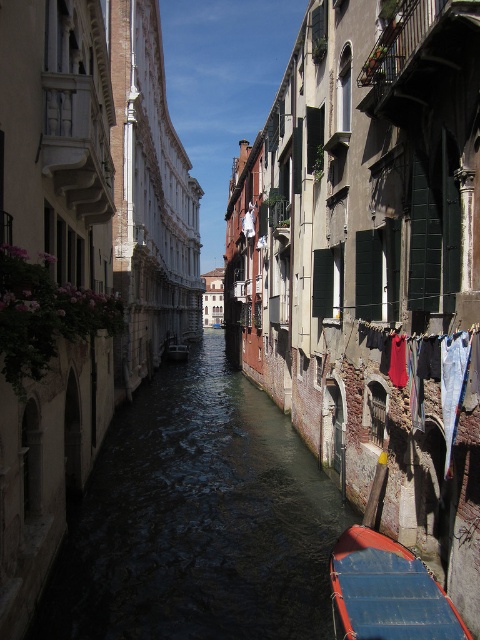
Does orange fabric boat at lower center have a lesser height compared to red fabric clothesline at right?

Indeed, orange fabric boat at lower center has a lesser height compared to red fabric clothesline at right.

Which is above, orange fabric boat at lower center or red fabric clothesline at right?

red fabric clothesline at right is higher up.

Is point (439, 589) farther from camera compared to point (462, 339)?

That is True.

Locate an element on the screen. orange fabric boat at lower center is located at coordinates (387, 592).

Can you confirm if dark water at center is taller than orange fabric boat at lower center?

Correct, dark water at center is much taller as orange fabric boat at lower center.

Between point (256, 572) and point (404, 561), which one is positioned behind?

The point (256, 572) is behind.

Image resolution: width=480 pixels, height=640 pixels. What are the coordinates of `dark water at center` in the screenshot? It's located at (197, 518).

Does dark water at center appear under red fabric clothesline at right?

Indeed, dark water at center is positioned under red fabric clothesline at right.

Looking at this image, does dark water at center appear over red fabric clothesline at right?

No, dark water at center is not above red fabric clothesline at right.

Find the location of a particular element. dark water at center is located at coordinates (197, 518).

The width and height of the screenshot is (480, 640). What are the coordinates of `dark water at center` in the screenshot? It's located at (x=197, y=518).